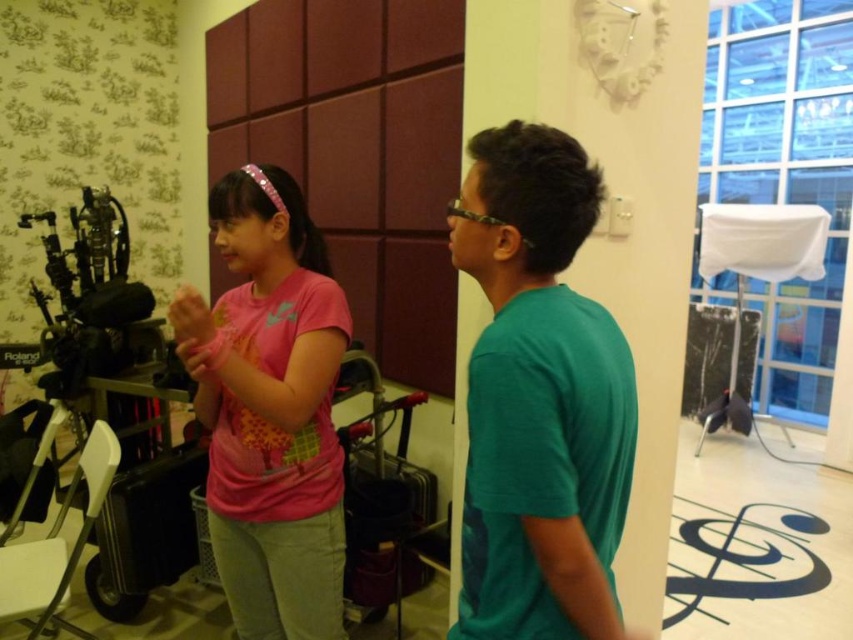
Question: Which point is closer to the camera?

Choices:
 (A) teal matte t-shirt at center
 (B) pink matte shirt at center

Answer: (A)

Question: Does teal matte t-shirt at center have a larger size compared to pink matte shirt at center?

Choices:
 (A) yes
 (B) no

Answer: (B)

Question: Can you confirm if teal matte t-shirt at center is positioned to the right of pink matte shirt at center?

Choices:
 (A) yes
 (B) no

Answer: (A)

Question: Can you confirm if teal matte t-shirt at center is wider than pink matte shirt at center?

Choices:
 (A) no
 (B) yes

Answer: (A)

Question: Which point appears farthest from the camera in this image?

Choices:
 (A) (189, 364)
 (B) (601, 417)

Answer: (A)